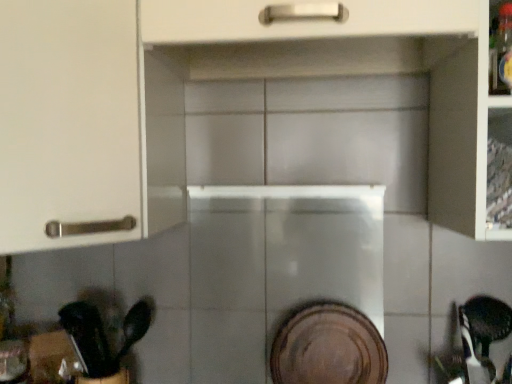
Question: Is white matte cabinet at upper left bigger than black plastic spoon at lower left?

Choices:
 (A) yes
 (B) no

Answer: (A)

Question: Is white matte cabinet at upper left beside black plastic spoon at lower left?

Choices:
 (A) yes
 (B) no

Answer: (B)

Question: Considering the relative sizes of white matte cabinet at upper left and black plastic spoon at lower left in the image provided, is white matte cabinet at upper left taller than black plastic spoon at lower left?

Choices:
 (A) no
 (B) yes

Answer: (B)

Question: Is white matte cabinet at upper left positioned beyond the bounds of black plastic spoon at lower left?

Choices:
 (A) yes
 (B) no

Answer: (A)

Question: Does white matte cabinet at upper left contain black plastic spoon at lower left?

Choices:
 (A) yes
 (B) no

Answer: (B)

Question: Is white matte cabinet at upper left oriented away from black plastic spoon at lower left?

Choices:
 (A) no
 (B) yes

Answer: (A)

Question: Is brown matte platter at center shorter than white matte cabinet at upper left?

Choices:
 (A) no
 (B) yes

Answer: (B)

Question: Is brown matte platter at center at the left side of white matte cabinet at upper left?

Choices:
 (A) no
 (B) yes

Answer: (A)

Question: Is brown matte platter at center bigger than white matte cabinet at upper left?

Choices:
 (A) yes
 (B) no

Answer: (B)

Question: Is brown matte platter at center to the right of white matte cabinet at upper left from the viewer's perspective?

Choices:
 (A) yes
 (B) no

Answer: (A)

Question: From a real-world perspective, is brown matte platter at center under white matte cabinet at upper left?

Choices:
 (A) no
 (B) yes

Answer: (B)

Question: Considering the relative sizes of brown matte platter at center and white matte cabinet at upper left in the image provided, is brown matte platter at center thinner than white matte cabinet at upper left?

Choices:
 (A) yes
 (B) no

Answer: (A)

Question: Is brown matte platter at center closer to camera compared to black plastic spoon at lower left?

Choices:
 (A) yes
 (B) no

Answer: (B)